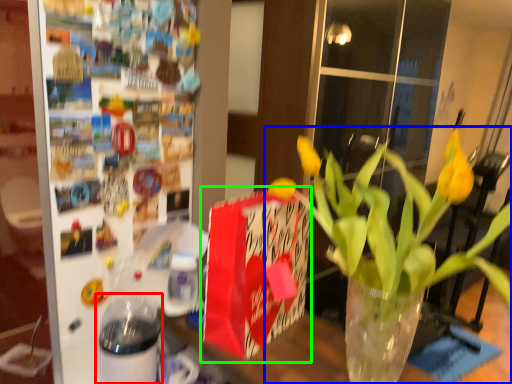
Question: Which object is positioned farthest from glass jar (highlighted by a red box)? Select from houseplant (highlighted by a blue box) and gift bag (highlighted by a green box).

Choices:
 (A) houseplant
 (B) gift bag

Answer: (A)